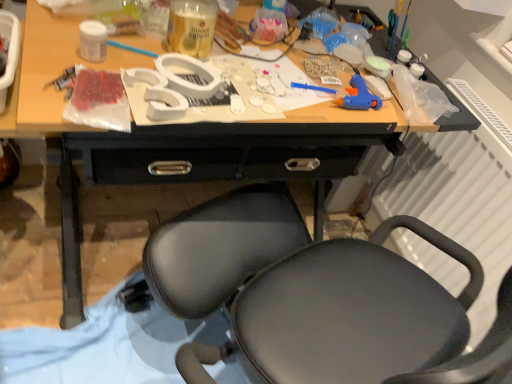
Where is `black matte chair at center`? black matte chair at center is located at coordinates (317, 298).

In order to click on white matte jar at upper left, the 1th bottle viewed from the left in this screenshot , I will do `click(93, 40)`.

Describe the element at coordinates (93, 40) in the screenshot. The width and height of the screenshot is (512, 384). I see `white matte jar at upper left, arranged as the 3th bottle when viewed from the back` at that location.

Describe the element at coordinates (192, 27) in the screenshot. This screenshot has width=512, height=384. I see `translucent glass bottle at center, the second bottle viewed from the right` at that location.

This screenshot has width=512, height=384. Find the location of `blue plastic glue gun at right`. blue plastic glue gun at right is located at coordinates (358, 95).

This screenshot has height=384, width=512. I want to click on black matte chair at center, so click(317, 298).

Is black matte chair at center facing towards translucent plastic bottle at upper center, the first bottle in the right-to-left sequence?

No, black matte chair at center is not aimed at translucent plastic bottle at upper center, the first bottle in the right-to-left sequence.

From the image's perspective, is black matte chair at center above or below translucent plastic bottle at upper center, positioned as the first bottle in back-to-front order?

Clearly, from the image's perspective, black matte chair at center is below translucent plastic bottle at upper center, positioned as the first bottle in back-to-front order.

In the scene shown: Is black matte chair at center not within translucent plastic bottle at upper center, the 3th bottle from the front?

Indeed, black matte chair at center is completely outside translucent plastic bottle at upper center, the 3th bottle from the front.

How much distance is there between black matte chair at center and translucent plastic bottle at upper center, acting as the third bottle starting from the left?

black matte chair at center and translucent plastic bottle at upper center, acting as the third bottle starting from the left, are 23.26 inches apart.

Could you tell me if black matte chair at center is turned towards white matte jar at upper left, arranged as the 3th bottle when viewed from the back?

No, black matte chair at center is not aimed at white matte jar at upper left, arranged as the 3th bottle when viewed from the back.

Is black matte chair at center in contact with white matte jar at upper left, placed as the first bottle when sorted from front to back?

black matte chair at center and white matte jar at upper left, placed as the first bottle when sorted from front to back, are clearly separated.

From the image's perspective, would you say black matte chair at center is shown under white matte jar at upper left, acting as the third bottle starting from the right?

Yes.

Can you confirm if black matte chair at center is positioned to the right of white matte jar at upper left, the 1th bottle viewed from the left?

Correct, you'll find black matte chair at center to the right of white matte jar at upper left, the 1th bottle viewed from the left.

Consider the image. Considering the positions of objects blue plastic glue gun at right and translucent plastic bottle at upper center, acting as the third bottle starting from the left, in the image provided, who is in front, blue plastic glue gun at right or translucent plastic bottle at upper center, acting as the third bottle starting from the left,?

blue plastic glue gun at right is more forward.

Which point is more distant from viewer, (371, 107) or (283, 21)?

Positioned behind is point (283, 21).

Based on their positions, is blue plastic glue gun at right located to the left or right of translucent plastic bottle at upper center, the 3th bottle from the front?

Based on their positions, blue plastic glue gun at right is located to the right of translucent plastic bottle at upper center, the 3th bottle from the front.

Considering the sizes of objects blue plastic glue gun at right and translucent plastic bottle at upper center, the 3th bottle from the front, in the image provided, who is thinner, blue plastic glue gun at right or translucent plastic bottle at upper center, the 3th bottle from the front,?

translucent plastic bottle at upper center, the 3th bottle from the front, is thinner.

Considering the points (390, 321) and (355, 88), which point is in front, point (390, 321) or point (355, 88)?

Positioned in front is point (390, 321).

From a real-world perspective, who is located lower, black matte chair at center or blue plastic glue gun at right?

black matte chair at center, from a real-world perspective.

Does black matte chair at center have a smaller size compared to blue plastic glue gun at right?

No, black matte chair at center is not smaller than blue plastic glue gun at right.

Are black matte chair at center and blue plastic glue gun at right located far from each other?

black matte chair at center is near blue plastic glue gun at right, not far away.

Is white plastic radiator at right not inside black matte chair at center?

Yes, white plastic radiator at right is located beyond the bounds of black matte chair at center.

Is white plastic radiator at right facing towards black matte chair at center?

Yes, white plastic radiator at right is turned towards black matte chair at center.

What's the angular difference between white plastic radiator at right and black matte chair at center's facing directions?

The facing directions of white plastic radiator at right and black matte chair at center are 180 degrees apart.

In the image, is white plastic radiator at right positioned in front of or behind black matte chair at center?

In the image, white plastic radiator at right appears in front of black matte chair at center.

Is white plastic radiator at right surrounding blue plastic glue gun at right?

Actually, blue plastic glue gun at right is outside white plastic radiator at right.

Is white plastic radiator at right wider than blue plastic glue gun at right?

Incorrect, the width of white plastic radiator at right does not surpass that of blue plastic glue gun at right.

Does translucent glass bottle at center, placed as the second bottle when sorted from left to right, contain blue plastic glue gun at right?

Definitely not — blue plastic glue gun at right is not inside translucent glass bottle at center, placed as the second bottle when sorted from left to right.

Is translucent glass bottle at center, placed as the second bottle when sorted from left to right, positioned with its back to blue plastic glue gun at right?

translucent glass bottle at center, placed as the second bottle when sorted from left to right, is not turned away from blue plastic glue gun at right.

In the image, is translucent glass bottle at center, which appears as the 2th bottle when viewed from the front, positioned in front of or behind blue plastic glue gun at right?

Visually, translucent glass bottle at center, which appears as the 2th bottle when viewed from the front, is located in front of blue plastic glue gun at right.

Find the location of `the 1st bottle in front of the blue plastic glue gun at right`. the 1st bottle in front of the blue plastic glue gun at right is located at coordinates (192, 27).

Find the location of a particular element. This screenshot has height=384, width=512. chair below the translucent plastic bottle at upper center, the first bottle in the right-to-left sequence (from the image's perspective) is located at coordinates (317, 298).

Identify the location of chair behind the white matte jar at upper left, the 1th bottle viewed from the left. The image size is (512, 384). (317, 298).

When comparing their distances from black matte chair at center, does white plastic radiator at right or white matte jar at upper left, the 1th bottle viewed from the left, seem closer?

Based on the image, white plastic radiator at right appears to be nearer to black matte chair at center.

From the image, which object appears to be farther from translucent glass bottle at center, which appears as the 2th bottle when viewed from the front, white matte jar at upper left, acting as the third bottle starting from the right, or blue plastic glue gun at right?

The object further to translucent glass bottle at center, which appears as the 2th bottle when viewed from the front, is blue plastic glue gun at right.

Which object lies further to the anchor point black matte chair at center, translucent plastic bottle at upper center, the first bottle in the right-to-left sequence, or white plastic radiator at right?

translucent plastic bottle at upper center, the first bottle in the right-to-left sequence, is positioned further to the anchor black matte chair at center.

Considering their positions, is white plastic radiator at right positioned further to white matte jar at upper left, arranged as the 3th bottle when viewed from the back, than blue plastic glue gun at right?

The object further to white matte jar at upper left, arranged as the 3th bottle when viewed from the back, is white plastic radiator at right.

When comparing their distances from black matte chair at center, does blue plastic glue gun at right or translucent glass bottle at center, the second bottle viewed from the right, seem closer?

blue plastic glue gun at right is closer to black matte chair at center.

Looking at the image, which one is located closer to translucent glass bottle at center, which appears as the 2th bottle when viewed from the front, blue plastic glue gun at right or black matte chair at center?

blue plastic glue gun at right.

Looking at the image, which one is located closer to translucent plastic bottle at upper center, the 3th bottle from the front, translucent glass bottle at center, placed as the second bottle when sorted from left to right, or blue plastic glue gun at right?

translucent glass bottle at center, placed as the second bottle when sorted from left to right, lies closer to translucent plastic bottle at upper center, the 3th bottle from the front, than the other object.

Based on their spatial positions, is white plastic radiator at right or blue plastic glue gun at right closer to black matte chair at center?

The object closer to black matte chair at center is white plastic radiator at right.

Find the location of a particular element. toy situated between translucent plastic bottle at upper center, the first bottle in the right-to-left sequence, and white plastic radiator at right from left to right is located at coordinates (358, 95).

Identify the location of toy between translucent glass bottle at center, the second bottle from the back, and black matte chair at center vertically. (358, 95).

Locate an element on the screen. The height and width of the screenshot is (384, 512). toy between translucent plastic bottle at upper center, the 3th bottle from the front, and black matte chair at center in the up-down direction is located at coordinates (358, 95).

What are the coordinates of `chair located between white matte jar at upper left, acting as the third bottle starting from the right, and blue plastic glue gun at right in the left-right direction` in the screenshot? It's located at (317, 298).